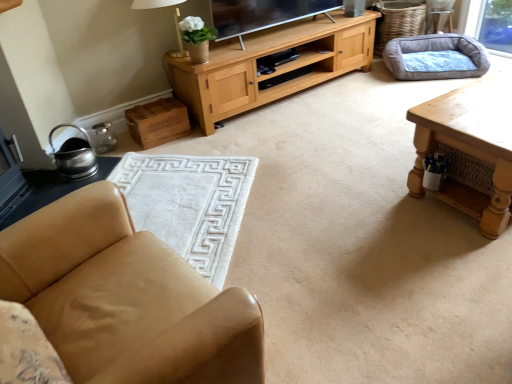
This screenshot has width=512, height=384. Find the location of `light brown leather armchair at upper right`. light brown leather armchair at upper right is located at coordinates (439, 15).

Find the location of a particular element. The width and height of the screenshot is (512, 384). wooden table at right is located at coordinates (470, 145).

This screenshot has width=512, height=384. What do you see at coordinates (125, 298) in the screenshot? I see `tan leather chair at lower left` at bounding box center [125, 298].

Where is `white soft rug at lower left`? white soft rug at lower left is located at coordinates (189, 204).

What do you see at coordinates (437, 53) in the screenshot?
I see `gray fabric dog bed at upper right` at bounding box center [437, 53].

This screenshot has width=512, height=384. What are the coordinates of `white fabric lampshade at upper center` in the screenshot? It's located at (173, 17).

You are a GUI agent. You are given a task and a screenshot of the screen. Output one action in this format:
    pyautogui.click(x=<x>, y=<y>)
    Task: Click on the brushed metal side table at lower left
    
    Given the screenshot: What is the action you would take?
    pyautogui.click(x=53, y=188)

Which of these two, wooden table at right or tan leather chair at lower left, is smaller?

Smaller between the two is wooden table at right.

Which object is positioned more to the left, wooden table at right or tan leather chair at lower left?

tan leather chair at lower left is more to the left.

Image resolution: width=512 pixels, height=384 pixels. Identify the location of chair lying in front of the wooden table at right. (125, 298).

Which object is further away from the camera, wooden table at right or tan leather chair at lower left?

wooden table at right is more distant.

Does gray fabric dog bed at upper right touch white fabric lampshade at upper center?

No, gray fabric dog bed at upper right is not touching white fabric lampshade at upper center.

From a real-world perspective, is gray fabric dog bed at upper right physically below white fabric lampshade at upper center?

Yes, from a real-world perspective, gray fabric dog bed at upper right is under white fabric lampshade at upper center.

Considering the sizes of objects gray fabric dog bed at upper right and white fabric lampshade at upper center in the image provided, who is smaller, gray fabric dog bed at upper right or white fabric lampshade at upper center?

With smaller size is white fabric lampshade at upper center.

Considering the sizes of objects gray fabric dog bed at upper right and white fabric lampshade at upper center in the image provided, who is thinner, gray fabric dog bed at upper right or white fabric lampshade at upper center?

With smaller width is white fabric lampshade at upper center.

How distant is brushed metal side table at lower left from white soft rug at lower left?

brushed metal side table at lower left is 19.97 inches away from white soft rug at lower left.

You are a GUI agent. You are given a task and a screenshot of the screen. Output one action in this format:
    pyautogui.click(x=<x>, y=<y>)
    Task: Click on the side table located on the left of white soft rug at lower left
    
    Given the screenshot: What is the action you would take?
    pyautogui.click(x=53, y=188)

Is brushed metal side table at lower left far from white soft rug at lower left?

Actually, brushed metal side table at lower left and white soft rug at lower left are a little close together.

Is brushed metal side table at lower left taller or shorter than white soft rug at lower left?

In the image, brushed metal side table at lower left appears to be shorter than white soft rug at lower left.

Is brushed metal side table at lower left beside wooden table at right?

No, brushed metal side table at lower left is not making contact with wooden table at right.

Is the position of brushed metal side table at lower left less distant than that of wooden table at right?

No, it is behind wooden table at right.

At what (x,y) coordinates should I click in order to perform the action: click on side table below the wooden table at right (from a real-world perspective). Please return your answer as a coordinate pair (x, y). The width and height of the screenshot is (512, 384). Looking at the image, I should click on (53, 188).

Does brushed metal side table at lower left appear on the right side of wooden table at right?

In fact, brushed metal side table at lower left is to the left of wooden table at right.

Identify the location of table in front of the white fabric lampshade at upper center. (470, 145).

Considering the positions of objects white fabric lampshade at upper center and wooden table at right in the image provided, who is more to the left, white fabric lampshade at upper center or wooden table at right?

white fabric lampshade at upper center is more to the left.

From the image's perspective, is white fabric lampshade at upper center above wooden table at right?

Correct, white fabric lampshade at upper center appears higher than wooden table at right in the image.

Does point (173, 13) appear closer or farther from the camera than point (507, 86)?

Point (173, 13) is farther from the camera than point (507, 86).

Locate an element on the screen. side table located in front of the light brown leather armchair at upper right is located at coordinates (53, 188).

Measure the distance between brushed metal side table at lower left and light brown leather armchair at upper right.

brushed metal side table at lower left is 10.80 feet away from light brown leather armchair at upper right.

In the image, is brushed metal side table at lower left on the left side or the right side of light brown leather armchair at upper right?

From the image, it's evident that brushed metal side table at lower left is to the left of light brown leather armchair at upper right.

From the image's perspective, is brushed metal side table at lower left positioned above or below light brown leather armchair at upper right?

brushed metal side table at lower left is situated lower than light brown leather armchair at upper right in the image.

From a real-world perspective, which object stands above the other?

In real-world perspective, brushed metal side table at lower left is above.

Are white soft rug at lower left and brushed metal side table at lower left making contact?

white soft rug at lower left and brushed metal side table at lower left are not in contact.

Is white soft rug at lower left oriented towards brushed metal side table at lower left?

Answer: No, white soft rug at lower left is not aimed at brushed metal side table at lower left.

Locate an element on the screen. This screenshot has height=384, width=512. table above the tan leather chair at lower left (from the image's perspective) is located at coordinates (470, 145).

Identify the location of dog bed that appears below the white fabric lampshade at upper center (from a real-world perspective). pyautogui.click(x=437, y=53).

When comparing their distances from brushed metal side table at lower left, does white fabric lampshade at upper center or light brown leather armchair at upper right seem further?

light brown leather armchair at upper right.

Looking at the image, which one is located further to light brown leather armchair at upper right, gray fabric dog bed at upper right or white soft rug at lower left?

white soft rug at lower left is further to light brown leather armchair at upper right.

From the image, which object appears to be nearer to white fabric lampshade at upper center, light brown leather armchair at upper right or wooden table at right?

wooden table at right.

From the image, which object appears to be farther from white soft rug at lower left, gray fabric dog bed at upper right or wooden table at right?

gray fabric dog bed at upper right lies further to white soft rug at lower left than the other object.

From the image, which object appears to be nearer to wooden table at right, gray fabric dog bed at upper right or tan leather chair at lower left?

tan leather chair at lower left is closer to wooden table at right.

Looking at the image, which one is located closer to gray fabric dog bed at upper right, brushed metal side table at lower left or wooden table at right?

wooden table at right is positioned closer to the anchor gray fabric dog bed at upper right.

From the image, which object appears to be farther from tan leather chair at lower left, light brown leather armchair at upper right or white soft rug at lower left?

light brown leather armchair at upper right is further to tan leather chair at lower left.

Which object lies nearer to the anchor point light brown leather armchair at upper right, brushed metal side table at lower left or wooden table at right?

wooden table at right is positioned closer to the anchor light brown leather armchair at upper right.

Identify the location of chair between white soft rug at lower left and wooden table at right. The image size is (512, 384). (125, 298).

Identify the location of dog bed between white soft rug at lower left and light brown leather armchair at upper right from left to right. (437, 53).

Identify the location of side table between white fabric lampshade at upper center and white soft rug at lower left in the vertical direction. The height and width of the screenshot is (384, 512). (53, 188).

Where is `dog bed between wooden table at right and light brown leather armchair at upper right along the z-axis`? dog bed between wooden table at right and light brown leather armchair at upper right along the z-axis is located at coordinates (437, 53).